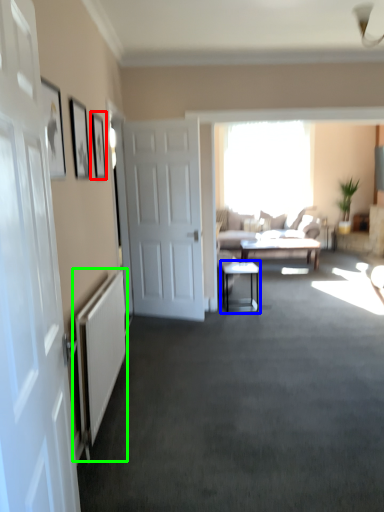
Question: Which object is the farthest from picture frame (highlighted by a red box)? Choose among these: table (highlighted by a blue box) or radiator (highlighted by a green box).

Choices:
 (A) table
 (B) radiator

Answer: (A)